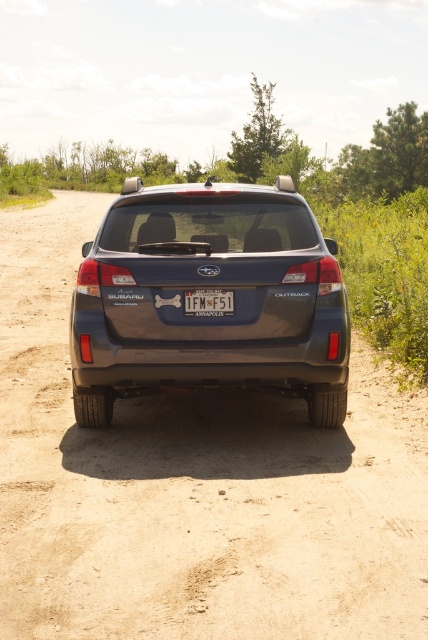
Question: Which object is the closest to the white plastic license plate at center?

Choices:
 (A) dirtloose sand at center
 (B) satin metallic suv at center

Answer: (B)

Question: Considering the relative positions of dirtloose sand at center and satin metallic suv at center in the image provided, where is dirtloose sand at center located with respect to satin metallic suv at center?

Choices:
 (A) right
 (B) left

Answer: (B)

Question: Considering the relative positions of dirtloose sand at center and satin metallic suv at center in the image provided, where is dirtloose sand at center located with respect to satin metallic suv at center?

Choices:
 (A) right
 (B) left

Answer: (B)

Question: Estimate the real-world distances between objects in this image. Which object is farther from the white plastic license plate at center?

Choices:
 (A) satin metallic suv at center
 (B) dirtloose sand at center

Answer: (B)

Question: Among these objects, which one is farthest from the camera?

Choices:
 (A) white plastic license plate at center
 (B) satin metallic suv at center

Answer: (A)

Question: Can you confirm if dirtloose sand at center is wider than satin metallic suv at center?

Choices:
 (A) yes
 (B) no

Answer: (A)